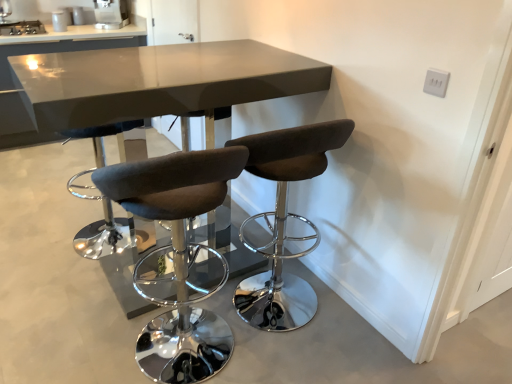
Image resolution: width=512 pixels, height=384 pixels. What do you see at coordinates (110, 14) in the screenshot?
I see `satin silver coffee machine at upper center, arranged as the 1th appliance when viewed from the right` at bounding box center [110, 14].

This screenshot has width=512, height=384. What do you see at coordinates (177, 258) in the screenshot?
I see `dark gray fabric stool at center, arranged as the 1th chair when viewed from the left` at bounding box center [177, 258].

The image size is (512, 384). In order to click on glossy gray table at upper center, which is the 1th table from left to right in this screenshot , I will do `click(68, 46)`.

The width and height of the screenshot is (512, 384). What do you see at coordinates (158, 81) in the screenshot? I see `matte gray table at center, which is counted as the second table, starting from the back` at bounding box center [158, 81].

What is the approximate width of matte gray table at center, the 2th table viewed from the left?

matte gray table at center, the 2th table viewed from the left, is 1.28 meters in width.

Where is `satin silver coffee machine at upper center, which is the 2th appliance in bottom-to-top order`? The image size is (512, 384). satin silver coffee machine at upper center, which is the 2th appliance in bottom-to-top order is located at coordinates (110, 14).

Can you confirm if glossy gray table at upper center, which is counted as the 1th table, starting from the back, is taller than brown fabric stool at center, the second chair in the left-to-right sequence?

In fact, glossy gray table at upper center, which is counted as the 1th table, starting from the back, may be shorter than brown fabric stool at center, the second chair in the left-to-right sequence.

Which is correct: glossy gray table at upper center, which is the 1th table from left to right, is inside brown fabric stool at center, the second chair in the left-to-right sequence, or outside of it?

glossy gray table at upper center, which is the 1th table from left to right, lies outside brown fabric stool at center, the second chair in the left-to-right sequence.

Looking at this image, from the image's perspective, relative to brown fabric stool at center, the second chair in the left-to-right sequence, is glossy gray table at upper center, arranged as the 2th table when viewed from the right, above or below?

From the image's perspective, glossy gray table at upper center, arranged as the 2th table when viewed from the right, appears above brown fabric stool at center, the second chair in the left-to-right sequence.

Can you confirm if dark gray fabric stool at center, which is counted as the 2th chair, starting from the right, is smaller than glossy gray table at upper center, which is the 1th table from left to right?

Yes.

From the dark gray fabric stool at center, which is counted as the 2th chair, starting from the right, count 2nd tables backward and point to it. Please provide its 2D coordinates.

[(68, 46)]

Considering the sizes of objects dark gray fabric stool at center, arranged as the 1th chair when viewed from the left, and glossy gray table at upper center, which is counted as the 1th table, starting from the back, in the image provided, who is wider, dark gray fabric stool at center, arranged as the 1th chair when viewed from the left, or glossy gray table at upper center, which is counted as the 1th table, starting from the back,?

With larger width is glossy gray table at upper center, which is counted as the 1th table, starting from the back.

How much distance is there between dark gray fabric stool at center, arranged as the 1th chair when viewed from the left, and glossy gray table at upper center, positioned as the second table in front-to-back order?

dark gray fabric stool at center, arranged as the 1th chair when viewed from the left, and glossy gray table at upper center, positioned as the second table in front-to-back order, are 2.25 meters apart.

How different are the orientations of stainless steel stove at upper left, the 2th appliance when ordered from right to left, and brown fabric stool at center, the second chair in the left-to-right sequence, in degrees?

stainless steel stove at upper left, the 2th appliance when ordered from right to left, and brown fabric stool at center, the second chair in the left-to-right sequence, are facing 178 degrees away from each other.

Which point is more distant from viewer, (36, 30) or (256, 297)?

The point (36, 30) is farther.

Which object is thinner, stainless steel stove at upper left, the 2th appliance when ordered from right to left, or brown fabric stool at center, the second chair in the left-to-right sequence?

With smaller width is brown fabric stool at center, the second chair in the left-to-right sequence.

You are a GUI agent. You are given a task and a screenshot of the screen. Output one action in this format:
    pyautogui.click(x=<x>, y=<y>)
    Task: Click on the 1st appliance positioned above the brown fabric stool at center, marked as the 1th chair in a right-to-left arrangement (from the image's perspective)
    This screenshot has width=512, height=384.
    Given the screenshot: What is the action you would take?
    pyautogui.click(x=22, y=28)

Considering the relative sizes of brown fabric stool at center, the second chair in the left-to-right sequence, and dark gray fabric stool at center, arranged as the 1th chair when viewed from the left, in the image provided, is brown fabric stool at center, the second chair in the left-to-right sequence, wider than dark gray fabric stool at center, arranged as the 1th chair when viewed from the left,?

Yes.

From the image's perspective, would you say brown fabric stool at center, the second chair in the left-to-right sequence, is shown under dark gray fabric stool at center, arranged as the 1th chair when viewed from the left?

No, from the image's perspective, brown fabric stool at center, the second chair in the left-to-right sequence, is not beneath dark gray fabric stool at center, arranged as the 1th chair when viewed from the left.

From a real-world perspective, between brown fabric stool at center, marked as the 1th chair in a right-to-left arrangement, and dark gray fabric stool at center, which is counted as the 2th chair, starting from the right, who is vertically higher?

In real-world perspective, brown fabric stool at center, marked as the 1th chair in a right-to-left arrangement, is above.

Consider the image. Are brown fabric stool at center, the second chair in the left-to-right sequence, and dark gray fabric stool at center, arranged as the 1th chair when viewed from the left, making contact?

There is a gap between brown fabric stool at center, the second chair in the left-to-right sequence, and dark gray fabric stool at center, arranged as the 1th chair when viewed from the left.

Which point is more forward, (77, 40) or (206, 166)?

The point (206, 166) is closer.

Consider the image. From the image's perspective, which one is positioned lower, glossy gray table at upper center, positioned as the second table in front-to-back order, or dark gray fabric stool at center, which is counted as the 2th chair, starting from the right?

dark gray fabric stool at center, which is counted as the 2th chair, starting from the right.

From a real-world perspective, is glossy gray table at upper center, which is the 1th table from left to right, under dark gray fabric stool at center, which is counted as the 2th chair, starting from the right?

Yes.

Locate an element on the screen. the 1st appliance behind the dark gray fabric stool at center, which is counted as the 2th chair, starting from the right is located at coordinates (22, 28).

Which object is thinner, stainless steel stove at upper left, the 1th appliance in the bottom-to-top sequence, or dark gray fabric stool at center, arranged as the 1th chair when viewed from the left?

Thinner between the two is dark gray fabric stool at center, arranged as the 1th chair when viewed from the left.

Between point (20, 30) and point (145, 354), which one is positioned behind?

The point (20, 30) is behind.

The image size is (512, 384). Find the location of `table in front of the brown fabric stool at center, the second chair in the left-to-right sequence`. table in front of the brown fabric stool at center, the second chair in the left-to-right sequence is located at coordinates point(158,81).

Is brown fabric stool at center, the second chair in the left-to-right sequence, wider than matte gray table at center, which is counted as the second table, starting from the back?

In fact, brown fabric stool at center, the second chair in the left-to-right sequence, might be narrower than matte gray table at center, which is counted as the second table, starting from the back.

Who is taller, brown fabric stool at center, the second chair in the left-to-right sequence, or matte gray table at center, the 2th table viewed from the left?

matte gray table at center, the 2th table viewed from the left, is taller.

Is brown fabric stool at center, marked as the 1th chair in a right-to-left arrangement, next to matte gray table at center, the 2th table viewed from the left?

No, brown fabric stool at center, marked as the 1th chair in a right-to-left arrangement, is not in contact with matte gray table at center, the 2th table viewed from the left.

From the glossy gray table at upper center, which is counted as the 1th table, starting from the back, count 1st chairs forward and point to it. Please provide its 2D coordinates.

[(284, 221)]

This screenshot has width=512, height=384. What are the coordinates of `the 1st chair positioned above the glossy gray table at upper center, which is the 1th table from left to right (from a real-world perspective)` in the screenshot? It's located at (177, 258).

Estimate the real-world distances between objects in this image. Which object is further from dark gray fabric stool at center, which is counted as the 2th chair, starting from the right, brown fabric stool at center, marked as the 1th chair in a right-to-left arrangement, or stainless steel stove at upper left, acting as the 2th appliance starting from the top?

stainless steel stove at upper left, acting as the 2th appliance starting from the top, lies further to dark gray fabric stool at center, which is counted as the 2th chair, starting from the right, than the other object.

Looking at this image, which object lies nearer to the anchor point stainless steel stove at upper left, acting as the 2th appliance starting from the top, glossy gray table at upper center, which is counted as the 1th table, starting from the back, or satin silver coffee machine at upper center, which is the 2th appliance in bottom-to-top order?

glossy gray table at upper center, which is counted as the 1th table, starting from the back.

Estimate the real-world distances between objects in this image. Which object is further from stainless steel stove at upper left, the 2th appliance when ordered from right to left, satin silver coffee machine at upper center, placed as the second appliance when sorted from left to right, or dark gray fabric stool at center, arranged as the 1th chair when viewed from the left?

dark gray fabric stool at center, arranged as the 1th chair when viewed from the left, is further to stainless steel stove at upper left, the 2th appliance when ordered from right to left.

From the image, which object appears to be nearer to glossy gray table at upper center, which is counted as the 1th table, starting from the back, satin silver coffee machine at upper center, arranged as the 1th appliance when viewed from the right, or stainless steel stove at upper left, acting as the 2th appliance starting from the top?

satin silver coffee machine at upper center, arranged as the 1th appliance when viewed from the right, is positioned closer to the anchor glossy gray table at upper center, which is counted as the 1th table, starting from the back.

Looking at the image, which one is located closer to stainless steel stove at upper left, the 1th appliance in the bottom-to-top sequence, dark gray fabric stool at center, arranged as the 1th chair when viewed from the left, or brown fabric stool at center, the second chair in the left-to-right sequence?

dark gray fabric stool at center, arranged as the 1th chair when viewed from the left, is positioned closer to the anchor stainless steel stove at upper left, the 1th appliance in the bottom-to-top sequence.

Considering their positions, is stainless steel stove at upper left, acting as the 2th appliance starting from the top, positioned closer to dark gray fabric stool at center, arranged as the 1th chair when viewed from the left, than matte gray table at center, the 2th table viewed from the left?

matte gray table at center, the 2th table viewed from the left.

Which object lies further to the anchor point stainless steel stove at upper left, which is the first appliance in left-to-right order, glossy gray table at upper center, positioned as the second table in front-to-back order, or brown fabric stool at center, the second chair in the left-to-right sequence?

brown fabric stool at center, the second chair in the left-to-right sequence, is positioned further to the anchor stainless steel stove at upper left, which is the first appliance in left-to-right order.

Estimate the real-world distances between objects in this image. Which object is further from brown fabric stool at center, marked as the 1th chair in a right-to-left arrangement, stainless steel stove at upper left, which is the first appliance in left-to-right order, or matte gray table at center, the first table from the right?

stainless steel stove at upper left, which is the first appliance in left-to-right order, is positioned further to the anchor brown fabric stool at center, marked as the 1th chair in a right-to-left arrangement.

Locate an element on the screen. chair between dark gray fabric stool at center, arranged as the 1th chair when viewed from the left, and satin silver coffee machine at upper center, which is the 2th appliance in bottom-to-top order, in the front-back direction is located at coordinates (284, 221).

In order to click on chair between matte gray table at center, the 2th table viewed from the left, and brown fabric stool at center, the second chair in the left-to-right sequence, in the horizontal direction in this screenshot , I will do `click(177, 258)`.

Image resolution: width=512 pixels, height=384 pixels. Find the location of `chair positioned between matte gray table at center, the first table from the right, and satin silver coffee machine at upper center, which is the 2th appliance in bottom-to-top order, from near to far`. chair positioned between matte gray table at center, the first table from the right, and satin silver coffee machine at upper center, which is the 2th appliance in bottom-to-top order, from near to far is located at coordinates (284, 221).

This screenshot has width=512, height=384. What are the coordinates of `table between stainless steel stove at upper left, acting as the 2th appliance starting from the top, and satin silver coffee machine at upper center, positioned as the first appliance in top-to-bottom order, in the horizontal direction` in the screenshot? It's located at (68, 46).